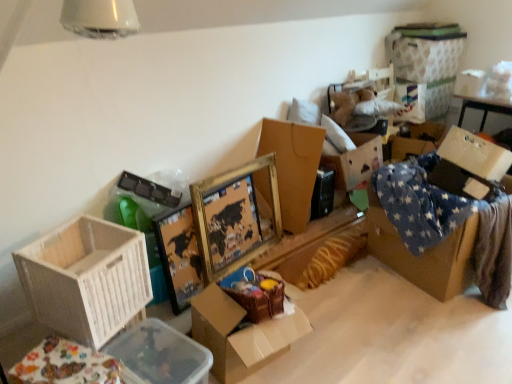
Question: Is clear plastic container at lower left, which ranks as the 1th storage box in front-to-back order, further to the viewer compared to gold/gilded picture frame at center?

Choices:
 (A) yes
 (B) no

Answer: (B)

Question: Considering the relative positions of clear plastic container at lower left, the 1th storage box viewed from the left, and gold/gilded picture frame at center in the image provided, is clear plastic container at lower left, the 1th storage box viewed from the left, to the left of gold/gilded picture frame at center from the viewer's perspective?

Choices:
 (A) yes
 (B) no

Answer: (A)

Question: Are clear plastic container at lower left, positioned as the third storage box in right-to-left order, and gold/gilded picture frame at center located far from each other?

Choices:
 (A) no
 (B) yes

Answer: (A)

Question: Considering the relative sizes of clear plastic container at lower left, arranged as the third storage box when viewed from the back, and gold/gilded picture frame at center in the image provided, is clear plastic container at lower left, arranged as the third storage box when viewed from the back, thinner than gold/gilded picture frame at center?

Choices:
 (A) no
 (B) yes

Answer: (A)

Question: From a real-world perspective, is clear plastic container at lower left, positioned as the 1th storage box in bottom-to-top order, on top of gold/gilded picture frame at center?

Choices:
 (A) no
 (B) yes

Answer: (A)

Question: Considering the relative positions of gold/gilded picture frame at center and white fabric storage box at upper right, acting as the 1th storage box starting from the top, in the image provided, is gold/gilded picture frame at center to the left or to the right of white fabric storage box at upper right, acting as the 1th storage box starting from the top,?

Choices:
 (A) right
 (B) left

Answer: (B)

Question: Considering the positions of point (251, 170) and point (402, 81), is point (251, 170) closer or farther from the camera than point (402, 81)?

Choices:
 (A) closer
 (B) farther

Answer: (A)

Question: Is gold/gilded picture frame at center wider or thinner than white fabric storage box at upper right, the 1th storage box in the right-to-left sequence?

Choices:
 (A) wide
 (B) thin

Answer: (B)

Question: Considering the positions of gold/gilded picture frame at center and white fabric storage box at upper right, which appears as the 3th storage box when ordered from the bottom, in the image, is gold/gilded picture frame at center bigger or smaller than white fabric storage box at upper right, which appears as the 3th storage box when ordered from the bottom,?

Choices:
 (A) small
 (B) big

Answer: (A)

Question: From the image's perspective, is white fabric storage box at upper right, which appears as the first storage box when viewed from the back, located above or below gold cardboard box at center, arranged as the 3th box when viewed from the front?

Choices:
 (A) below
 (B) above

Answer: (B)

Question: From a real-world perspective, is white fabric storage box at upper right, the third storage box viewed from the left, physically located above or below gold cardboard box at center, arranged as the 3th box when viewed from the front?

Choices:
 (A) above
 (B) below

Answer: (A)

Question: In terms of width, does white fabric storage box at upper right, which appears as the first storage box when viewed from the back, look wider or thinner when compared to gold cardboard box at center, acting as the 1th box starting from the back?

Choices:
 (A) thin
 (B) wide

Answer: (A)

Question: Based on their sizes in the image, would you say white fabric storage box at upper right, the third storage box viewed from the left, is bigger or smaller than gold cardboard box at center, arranged as the 3th box when viewed from the front?

Choices:
 (A) small
 (B) big

Answer: (B)

Question: Is clear plastic container at lower left, positioned as the third storage box in right-to-left order, inside the boundaries of gold/gilded picture frame at center, or outside?

Choices:
 (A) outside
 (B) inside

Answer: (A)

Question: From a real-world perspective, is clear plastic container at lower left, which ranks as the 1th storage box in front-to-back order, above or below gold/gilded picture frame at center?

Choices:
 (A) above
 (B) below

Answer: (B)